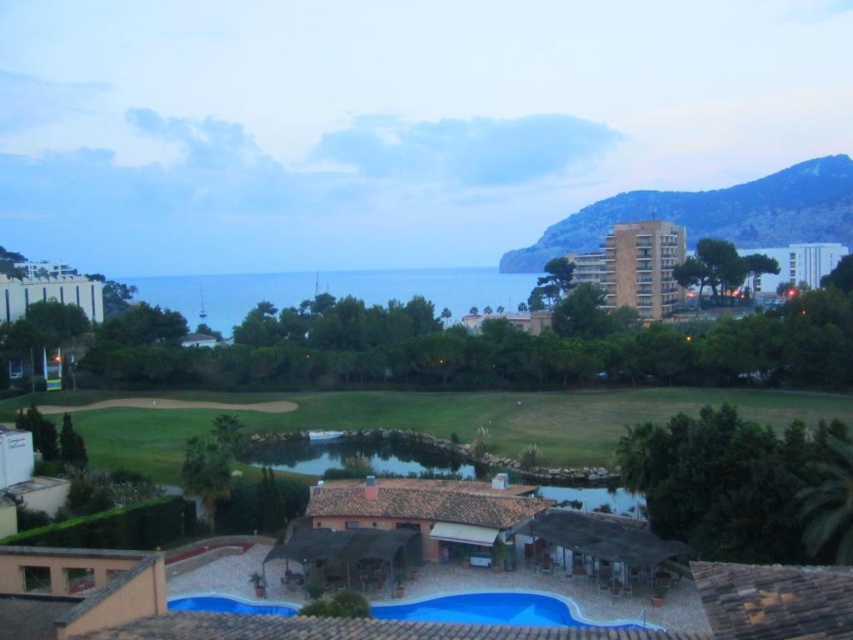
Question: Is green grass at center below beige concrete building at upper right?

Choices:
 (A) no
 (B) yes

Answer: (B)

Question: Is green grass at center behind blue plastic pool at lower center?

Choices:
 (A) yes
 (B) no

Answer: (A)

Question: Among these objects, which one is farthest from the camera?

Choices:
 (A) white glossy building at left
 (B) brown tiled roof at center

Answer: (A)

Question: Among these objects, which one is nearest to the camera?

Choices:
 (A) blue plastic pool at lower center
 (B) brown tiled roof at center
 (C) blue glossy pool at lower center
 (D) white glossy building at left

Answer: (A)

Question: Which point is closer to the camera taking this photo?

Choices:
 (A) (463, 467)
 (B) (252, 605)
 (C) (146, 300)
 (D) (99, 310)

Answer: (B)

Question: Does white glossy building at left have a lesser width compared to blue glossy pool at lower center?

Choices:
 (A) yes
 (B) no

Answer: (B)